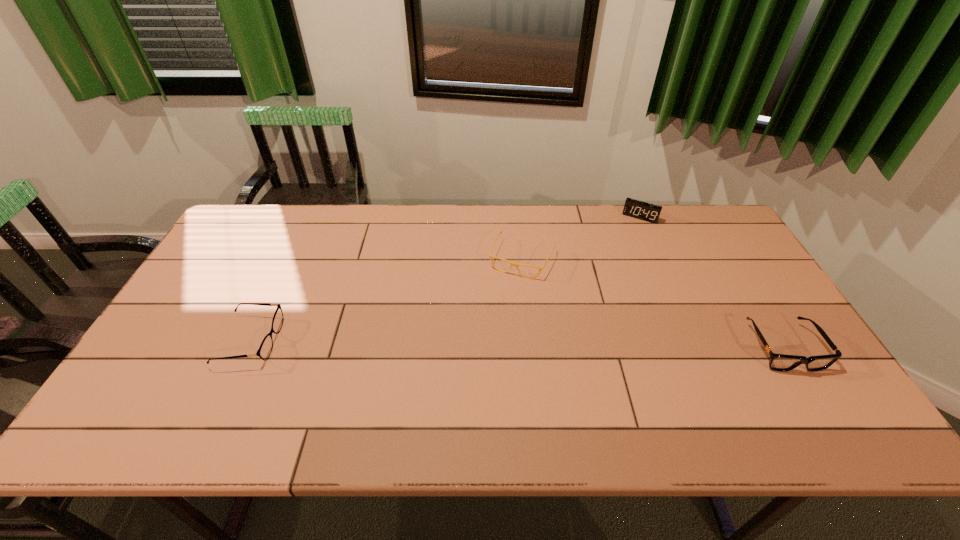
Identify the location of vacant space located 0.250m in front of the lenses of the third object from right to left. This screenshot has height=540, width=960. (483, 342).

The width and height of the screenshot is (960, 540). In order to click on free space located on the front-facing side of the second object from right to left in this screenshot , I will do point(625,245).

The height and width of the screenshot is (540, 960). Identify the location of vacant area located on the front-facing side of the second object from right to left. (612, 273).

Where is `vacant position located on the front-facing side of the second object from right to left`? vacant position located on the front-facing side of the second object from right to left is located at coordinates (623, 248).

Where is `spectacles that is positioned at the far edge`? spectacles that is positioned at the far edge is located at coordinates (490, 256).

Where is `alarm clock positioned at the far edge`? The height and width of the screenshot is (540, 960). alarm clock positioned at the far edge is located at coordinates pyautogui.click(x=637, y=209).

I want to click on spectacles that is at the near edge, so click(x=265, y=349).

Locate an element on the screen. The height and width of the screenshot is (540, 960). sunglasses situated at the near edge is located at coordinates (778, 362).

At what (x,y) coordinates should I click in order to perform the action: click on object situated at the right edge. Please return your answer as a coordinate pair (x, y). Looking at the image, I should click on (778, 362).

The height and width of the screenshot is (540, 960). Find the location of `object located at the near right corner`. object located at the near right corner is located at coordinates (778, 362).